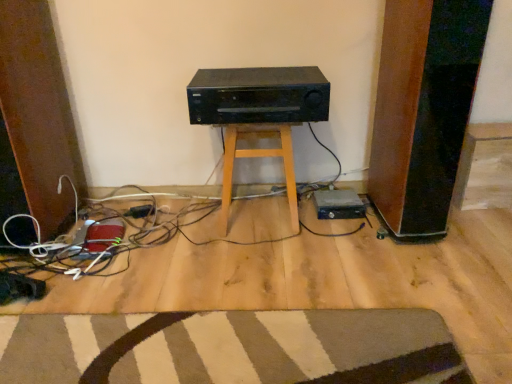
This screenshot has width=512, height=384. In order to click on unoccupied region to the right of striped carpet at lower center in this screenshot , I will do `click(402, 284)`.